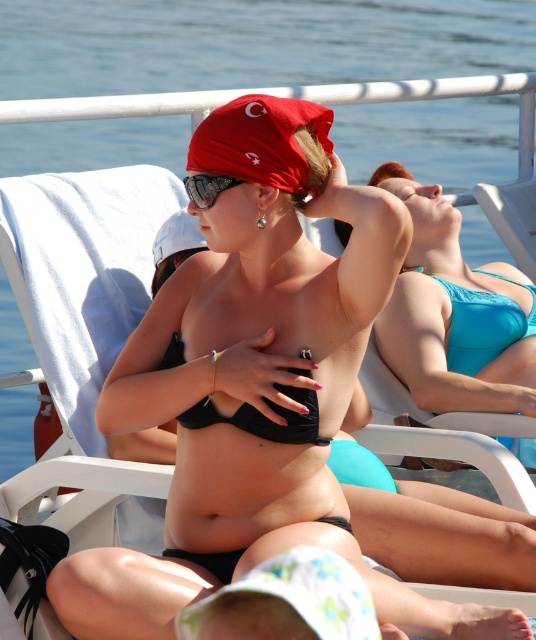
Can you confirm if turquoise fabric bikini top at upper right is positioned to the left of black matte bikini at center?

No, turquoise fabric bikini top at upper right is not to the left of black matte bikini at center.

Does turquoise fabric bikini top at upper right lie in front of black matte bikini at center?

No, it is behind black matte bikini at center.

Who is more forward, (496, 360) or (309, 403)?

Point (309, 403) is in front.

This screenshot has width=536, height=640. In order to click on turquoise fabric bikini top at upper right in this screenshot , I will do `click(455, 316)`.

Can you confirm if teal matte bikini at upper right is shorter than sunglasses at center?

No, teal matte bikini at upper right is not shorter than sunglasses at center.

Is point (502, 305) farther from camera compared to point (225, 177)?

Yes, point (502, 305) is behind point (225, 177).

In order to click on teal matte bikini at upper right in this screenshot , I will do `click(483, 323)`.

Which is more to the left, teal matte bikini at upper right or black matte bikini at center?

black matte bikini at center is more to the left.

Who is more forward, (531, 328) or (232, 420)?

Point (232, 420)

Locate an element on the screen. This screenshot has width=536, height=640. teal matte bikini at upper right is located at coordinates (483, 323).